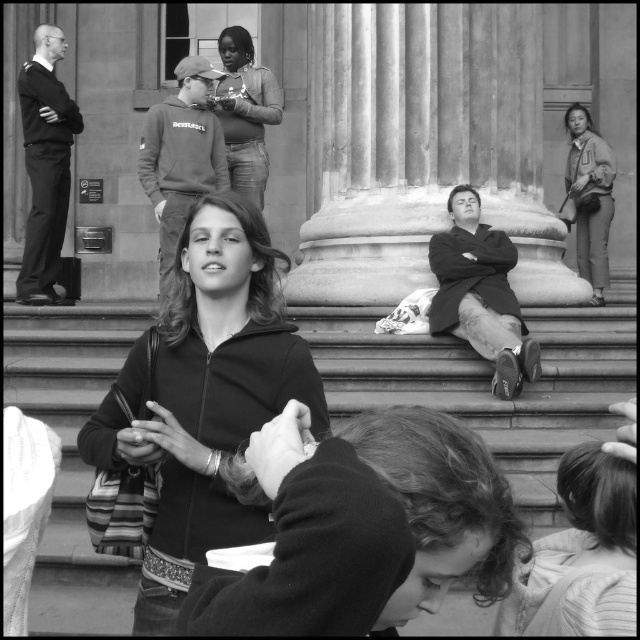
Does black matte jacket at center have a greater width compared to matte brown jacket at right?

Incorrect, black matte jacket at center's width does not surpass matte brown jacket at right's.

You are a GUI agent. You are given a task and a screenshot of the screen. Output one action in this format:
    pyautogui.click(x=<x>, y=<y>)
    Task: Click on the black matte jacket at center
    The image size is (640, 640).
    Given the screenshot: What is the action you would take?
    pyautogui.click(x=205, y=397)

Can you confirm if smooth concrete stairs at lower center is positioned above black matte jacket at center?

Yes.

Can you confirm if smooth concrete stairs at lower center is thinner than black matte jacket at center?

No, smooth concrete stairs at lower center is not thinner than black matte jacket at center.

I want to click on smooth concrete stairs at lower center, so click(x=488, y=380).

The image size is (640, 640). Identify the location of smooth concrete stairs at lower center. (488, 380).

Between matte black hoodie at center and matte brown jacket at right, which one has more height?

matte black hoodie at center

Who is positioned more to the left, matte black hoodie at center or matte brown jacket at right?

From the viewer's perspective, matte black hoodie at center appears more on the left side.

The height and width of the screenshot is (640, 640). Identify the location of matte black hoodie at center. (244, 113).